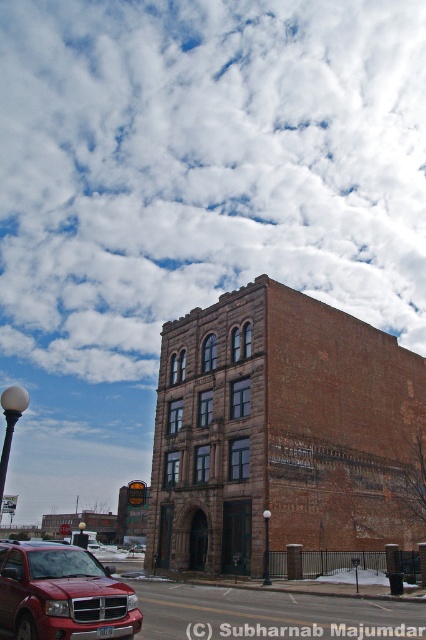
You are driving a metallic red suv at lower left and want to park it under the white fluffy cloud at upper center. Is this possible given their positions?

The white fluffy cloud at upper center is positioned over the metallic red suv at lower left, so the metallic red suv at lower left is already parked under the white fluffy cloud at upper center.

You are a photographer planning to take a picture of the matte red suv at lower left and the white fluffy cloud at upper center. Which object should you focus on first if you want to capture both in the same frame without moving the camera?

You should focus on the white fluffy cloud at upper center first because it is positioned on the left side of the matte red suv at lower left, ensuring both are in the frame when centered.

You are a delivery driver approaching the large brick building. You need to park your matte red suv at lower left in a spot that won t block the entrance. The parking area is near the building s front. Which direction should you move your vehicle to avoid the entrance, considering the white fluffy cloud at upper center is above your suv?

The white fluffy cloud at upper center is above the matte red suv at lower left, so the entrance is likely below the cloud. Move the suv away from the building s base where the entrance is located, perhaps to the side or further back, ensuring it doesn t block the entrance.